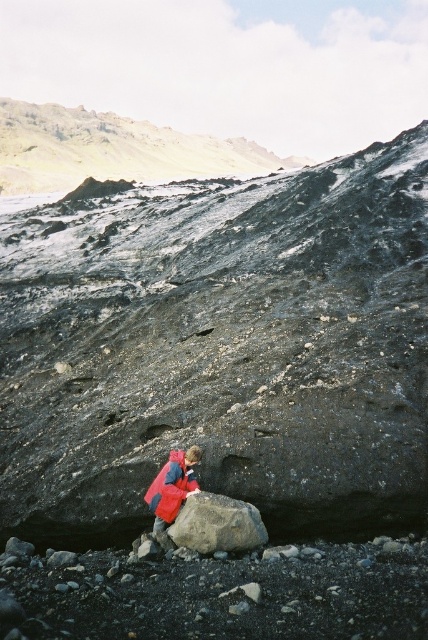
Between dark gray rocky cliff at upper center and red matte jacket at center, which one appears on the right side from the viewer's perspective?

Positioned to the right is red matte jacket at center.

Is dark gray rocky cliff at upper center further to camera compared to red matte jacket at center?

Yes, dark gray rocky cliff at upper center is further from the viewer.

Which is behind, point (61, 116) or point (195, 484)?

Positioned behind is point (61, 116).

Locate an element on the screen. The width and height of the screenshot is (428, 640). dark gray rocky cliff at upper center is located at coordinates (113, 150).

Does point (160, 141) come farther from viewer compared to point (244, 545)?

Yes, point (160, 141) is behind point (244, 545).

Does dark gray rocky cliff at upper center have a lesser width compared to gray rough rock at center?

Incorrect, dark gray rocky cliff at upper center's width is not less than gray rough rock at center's.

Which is behind, point (155, 168) or point (240, 532)?

The point (155, 168) is behind.

Identify the location of dark gray rocky cliff at upper center. Image resolution: width=428 pixels, height=640 pixels. (113, 150).

Who is lower down, smooth gray rock at center or red matte jacket at center?

red matte jacket at center

Does smooth gray rock at center have a greater height compared to red matte jacket at center?

Indeed, smooth gray rock at center has a greater height compared to red matte jacket at center.

Describe the element at coordinates (222, 348) in the screenshot. This screenshot has height=640, width=428. I see `smooth gray rock at center` at that location.

The image size is (428, 640). Identify the location of smooth gray rock at center. (222, 348).